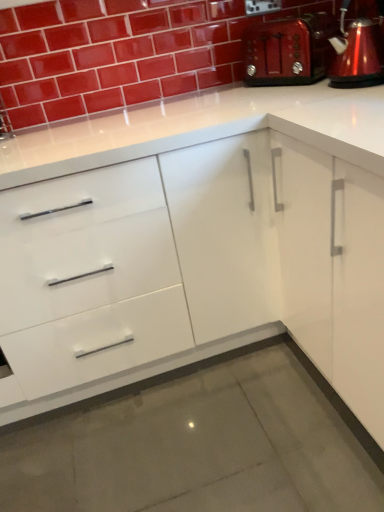
In order to click on vacant area situated to the left side of metallic red toaster at upper right in this screenshot , I will do `click(223, 94)`.